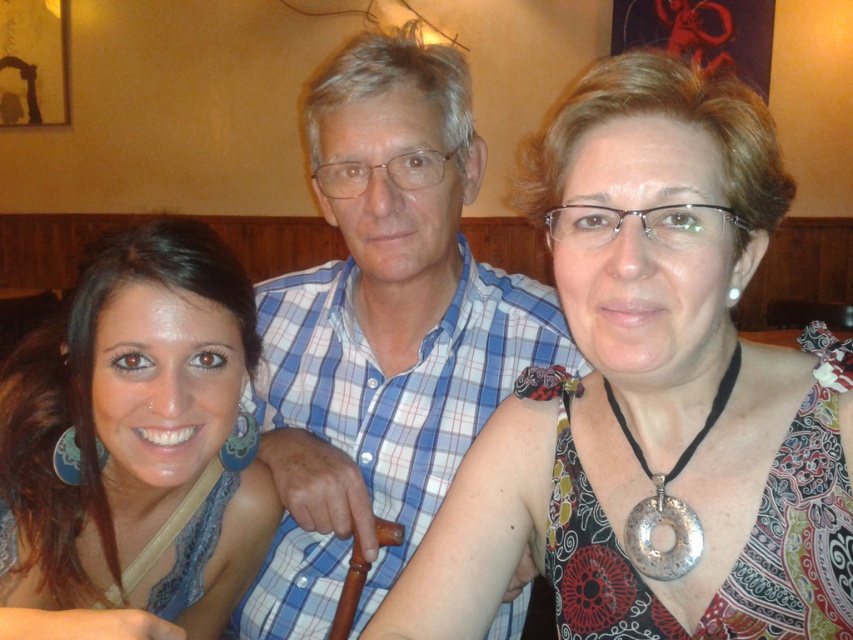
You are a photographer trying to adjust the lighting for a group photo. You notice the patterned fabric dress at center and the blue checkered shirt at center. Which clothing item requires more light adjustment to ensure its patterns are visible?

The patterned fabric dress at center has a smaller size compared to blue checkered shirt at center, so it may require more focused lighting adjustments to ensure its patterns are clearly visible.

You are standing in front of the image and want to describe the position of the patterned fabric dress at center. What are its coordinates?

The patterned fabric dress at center is located at coordinates point (654,394).